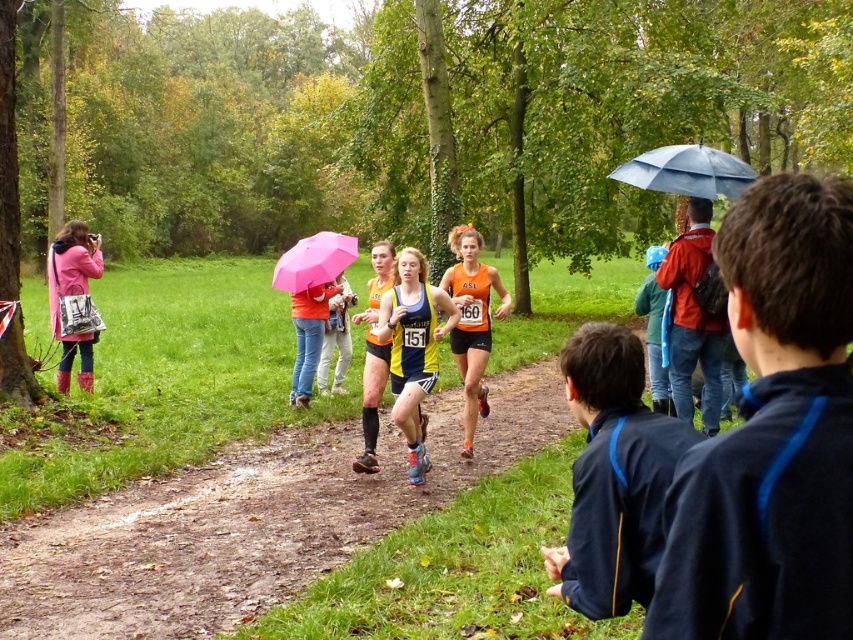
You are a runner in the cross country race and you are currently at the yellow and blue athletic suit at center. You need to reach the pink matte umbrella at center as quickly as possible. What is the shortest distance you can take?

The shortest distance between the yellow and blue athletic suit at center and the pink matte umbrella at center is 8.83 feet, so you should go straight towards the pink matte umbrella at center to cover that distance.

You are a spectator at the cross country race and want to know if the yellow and blue athletic suit at center is protected from the rain by the pink matte umbrella at center. According to the scene description, can you confirm this?

The yellow and blue athletic suit at center is positioned under the pink matte umbrella at center, so yes, the athlete is protected from the rain by the umbrella.